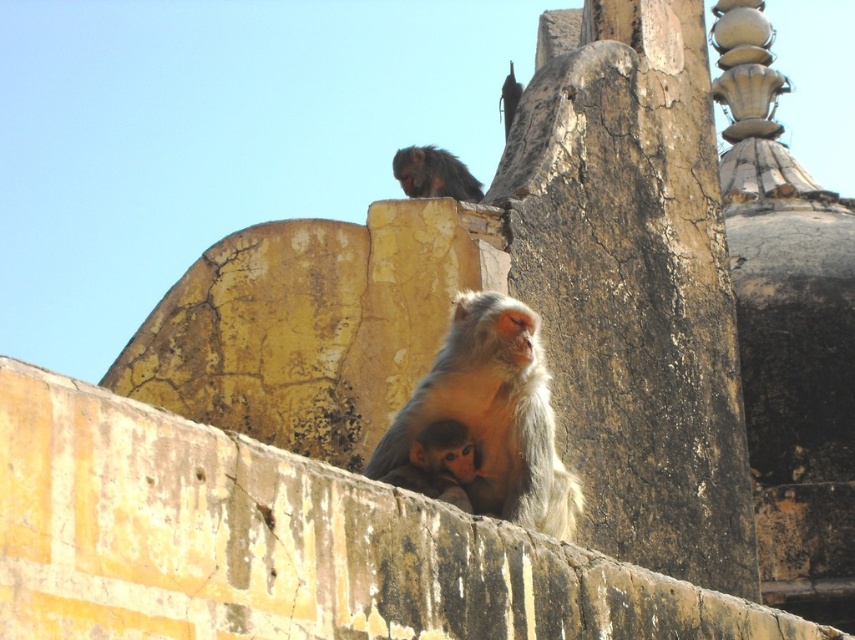
Question: Can you confirm if golden fur monkey at center is smaller than dark brown fur monkey at upper center?

Choices:
 (A) yes
 (B) no

Answer: (A)

Question: Is golden fur monkey at center closer to camera compared to light brown fur monkey at center?

Choices:
 (A) yes
 (B) no

Answer: (B)

Question: Does light brown fur monkey at center have a larger size compared to dark brown fur monkey at upper center?

Choices:
 (A) no
 (B) yes

Answer: (A)

Question: Which point is farther to the camera?

Choices:
 (A) (464, 452)
 (B) (563, 536)
 (C) (457, 188)

Answer: (C)

Question: Among these points, which one is farthest from the camera?

Choices:
 (A) (453, 500)
 (B) (396, 156)
 (C) (516, 413)

Answer: (B)

Question: Which object is the closest to the light brown fur monkey at center?

Choices:
 (A) dark brown fur monkey at upper center
 (B) golden fur monkey at center

Answer: (B)